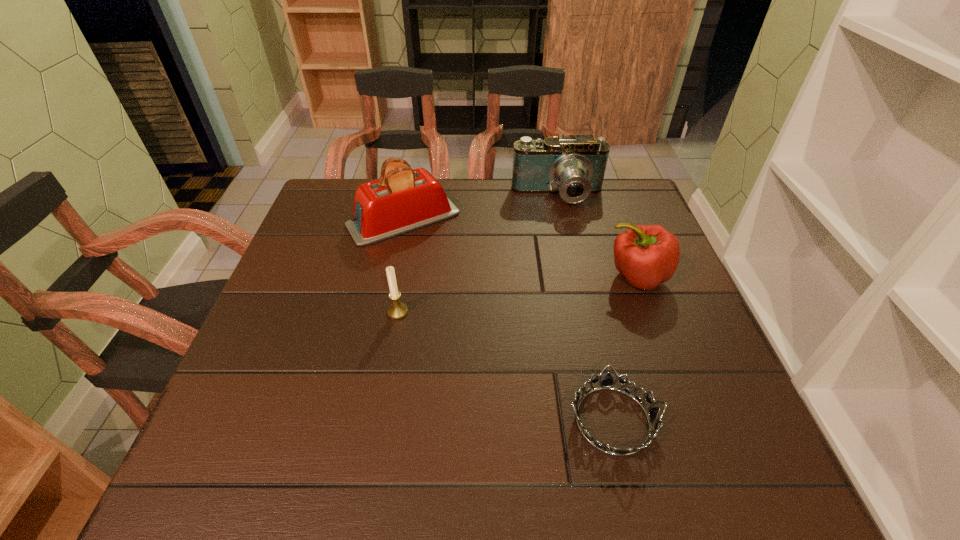
Where is `free spot between the nearest object and the bell pepper`? The width and height of the screenshot is (960, 540). free spot between the nearest object and the bell pepper is located at coordinates (625, 348).

This screenshot has width=960, height=540. I want to click on free space between the shortest object and the toaster, so click(x=508, y=320).

At what (x,y) coordinates should I click in order to perform the action: click on vacant area that lies between the candle holder and the camcorder. Please return your answer as a coordinate pair (x, y). Looking at the image, I should click on (478, 254).

I want to click on free space between the toaster and the bell pepper, so click(520, 248).

Where is `vacant point located between the third farthest object and the second nearest object`? vacant point located between the third farthest object and the second nearest object is located at coordinates (517, 294).

In order to click on free space that is in between the third farthest object and the nearest object in this screenshot , I will do click(625, 348).

Find the location of `vacant space in between the camcorder and the tiara`. vacant space in between the camcorder and the tiara is located at coordinates (586, 308).

Identify the location of empty space between the camcorder and the bell pepper. [x=597, y=237].

Where is `the second closest object to the second nearest object`? the second closest object to the second nearest object is located at coordinates (607, 383).

Identify which object is the fourth nearest to the camcorder. Please provide its 2D coordinates. Your answer should be formatted as a tuple, i.e. [(x, y)], where the tuple contains the x and y coordinates of a point satisfying the conditions above.

[(607, 383)]